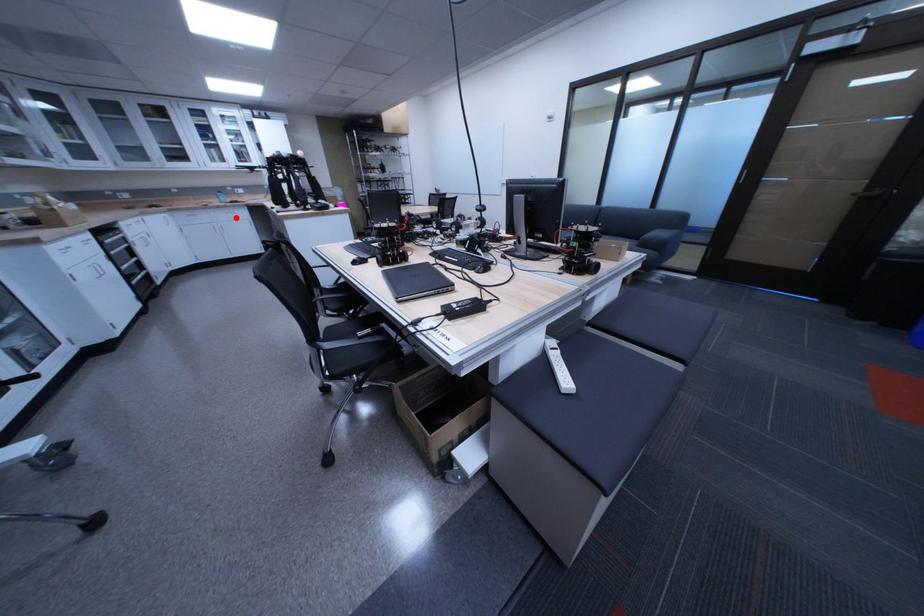
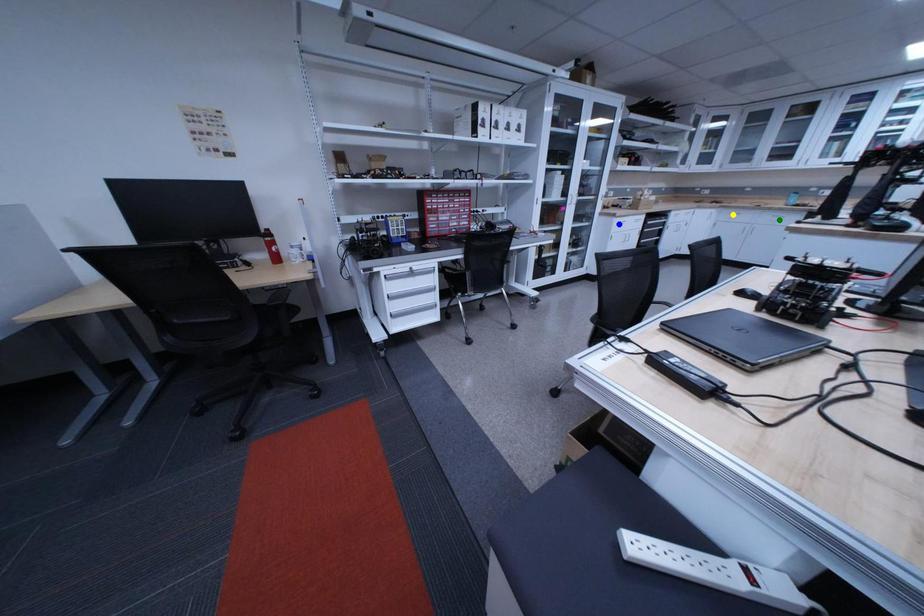
Question: I am providing you with two images of the same scene from different viewpoints. A red point is marked on the first image. You are given multiple points on the second image. Which mark in image 2 goes with the point in image 1?

Choices:
 (A) blue point
 (B) green point
 (C) yellow point

Answer: (B)